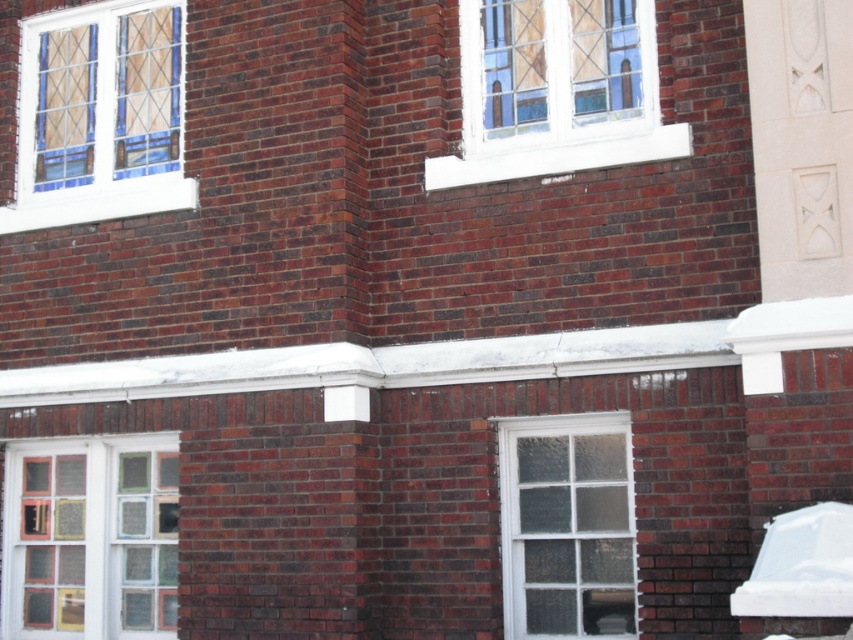
Looking at the brick building, which window is positioned to the left between the stained glass window at upper left and the clear glass window at center?

The stained glass window at upper left is positioned to the left of the clear glass window at center.

You are standing in front of a brick building and want to reach the stained glass window at upper left. The ladder you have can extend to 10 meters. Is it long enough to reach the window?

The stained glass window at upper left is 9.94 meters away from the viewer. Since the ladder can extend to 10 meters, it is long enough to reach the window.

You are standing in front of a brick building and want to reach the multicolored glass window at lower left. If your maximum reach is 2 meters, can you touch it without any tools?

The multicolored glass window at lower left is 9.81 meters away from viewer, which is much farther than your 2 meter reach. You cannot touch it without tools.